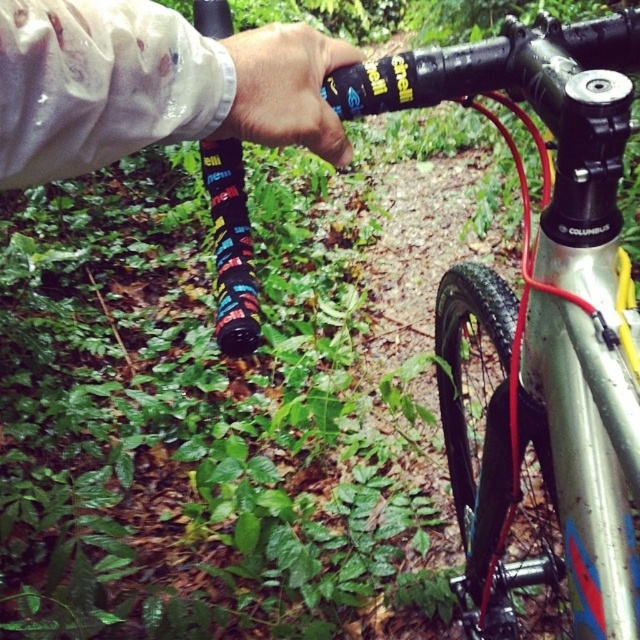
You are a cyclist trying to adjust your position on the handlebars. You need to reach a point behind your current hand position. Which of the two points, point [584,568] or point [248,58], is located behind your current hand position?

Point [584,568] is behind point [248,58], so if your current hand position is at point [248,58], then point [584,568] is behind it. However, if your hand is at point [584,568], then there is no point behind it in this context.

You are a cyclist who wants to adjust the position of your bike frame. The silver metallic frame at center is located at point (540, 337). Can you tell me the exact coordinates of the silver metallic frame at center?

The silver metallic frame at center is located at point (540, 337).